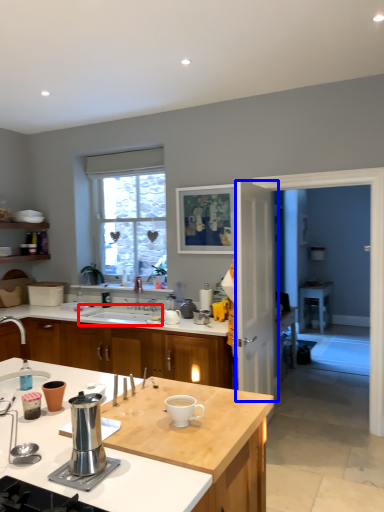
Question: Which object is closer to the camera taking this photo, sink (highlighted by a red box) or screen door (highlighted by a blue box)?

Choices:
 (A) sink
 (B) screen door

Answer: (B)